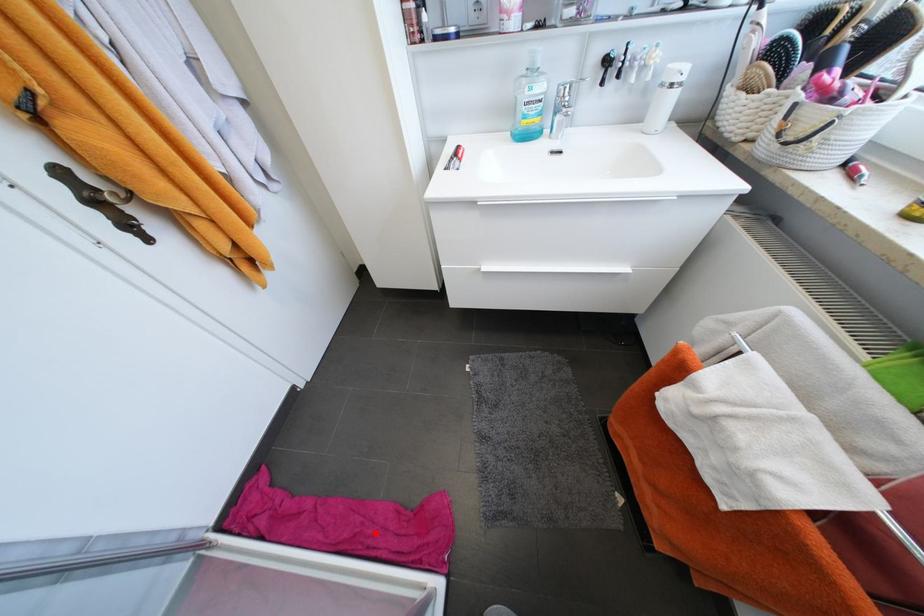
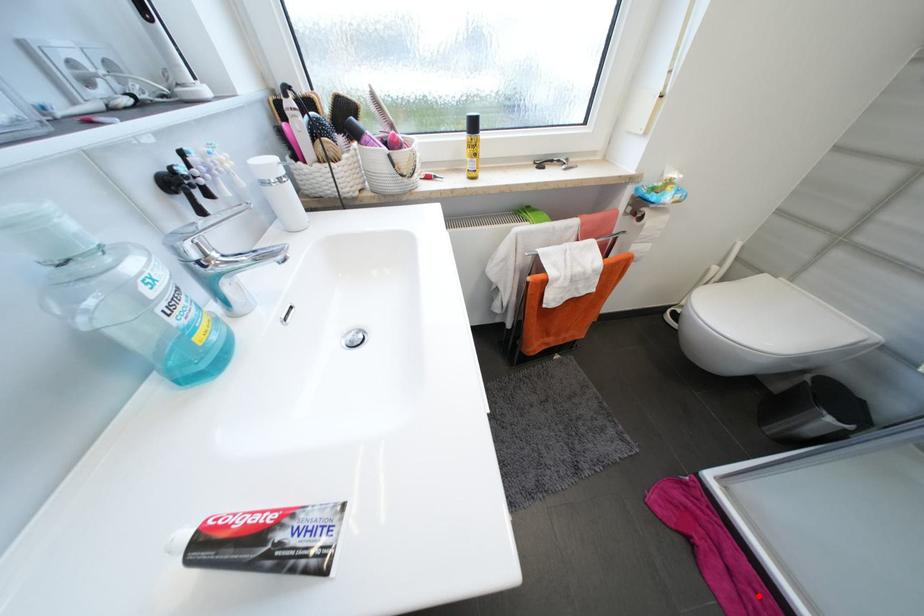
I am providing you with two images of the same scene from different viewpoints. A red point is marked on the first image and another point is marked on the second image. Does the point marked in image1 correspond to the same location as the one in image2?

Yes